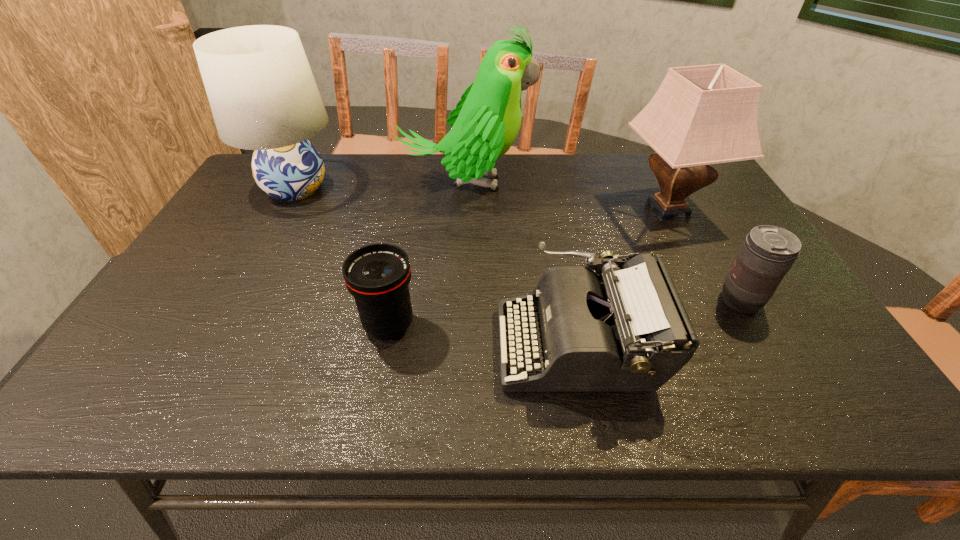
This screenshot has height=540, width=960. In order to click on parakeet in this screenshot , I will do `click(485, 123)`.

Identify the location of the leftmost object. This screenshot has height=540, width=960. (263, 96).

This screenshot has height=540, width=960. I want to click on the right lampshade, so click(x=700, y=115).

Locate an element on the screen. the right telephoto lens is located at coordinates coord(768,252).

Locate an element on the screen. the left telephoto lens is located at coordinates (377, 275).

Identify the location of typewriter. (626, 330).

What are the coordinates of `vacant space located on the beak of the parakeet` in the screenshot? It's located at (581, 183).

Identify the location of free spot located 0.190m on the front-facing side of the left lampshade. Image resolution: width=960 pixels, height=540 pixels. (402, 188).

At what (x,y) coordinates should I click in order to perform the action: click on free space located on the left of the right lampshade. Please return your answer as a coordinate pair (x, y). The image size is (960, 540). Looking at the image, I should click on (579, 210).

At what (x,y) coordinates should I click in order to perform the action: click on vacant area situated 0.290m on the side of the right telephoto lens where the control switches are located. Please return your answer as a coordinate pair (x, y). Looking at the image, I should click on (597, 301).